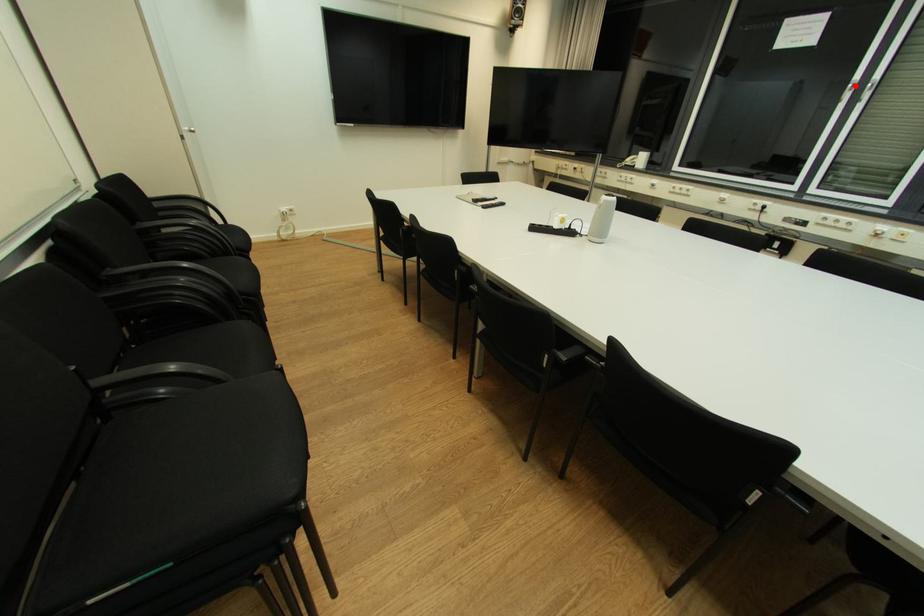
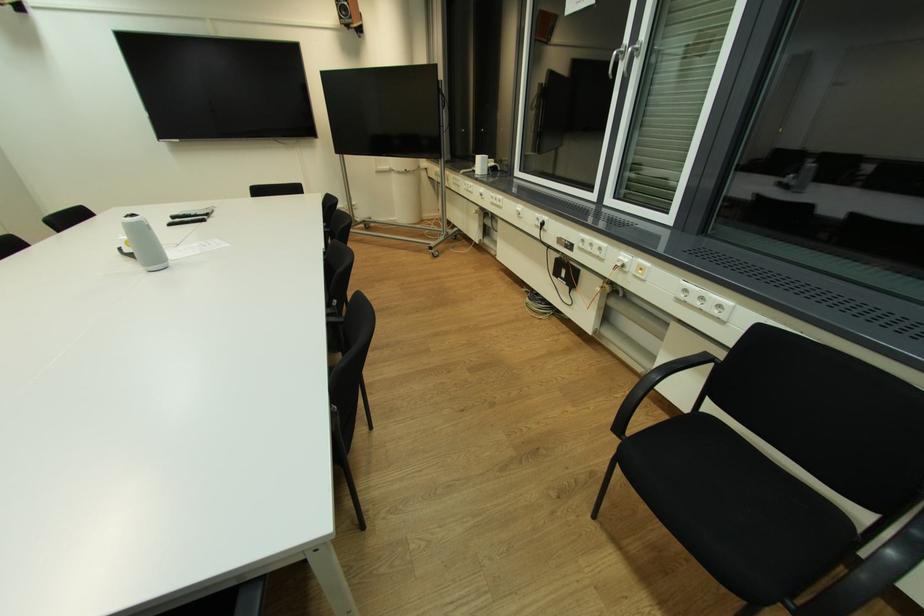
Locate, in the second image, the point that corresponds to the highlighted location in the first image.

(621, 54)